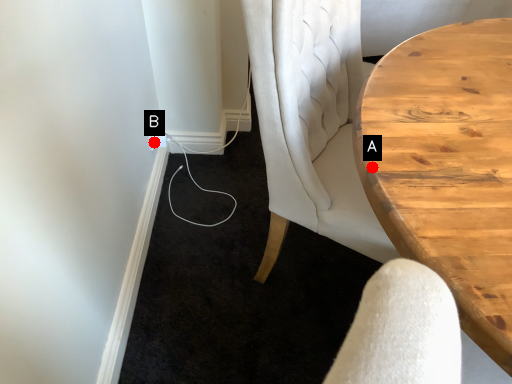
Question: Two points are circled on the image, labeled by A and B beside each circle. Among these points, which one is nearest to the camera?

Choices:
 (A) A is closer
 (B) B is closer

Answer: (A)